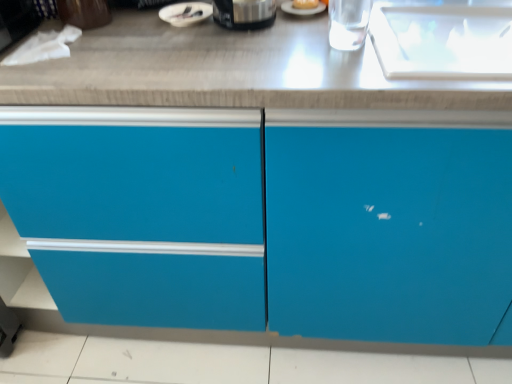
The image size is (512, 384). What are the coordinates of `free space in front of golden bread at center` in the screenshot? It's located at (304, 32).